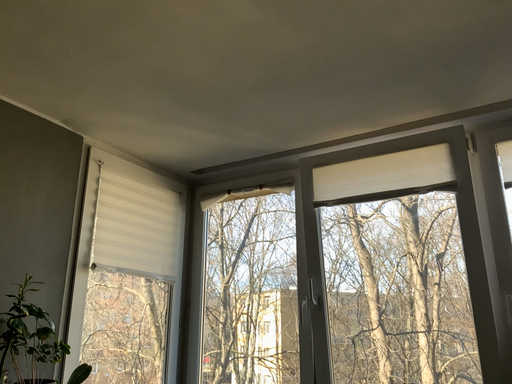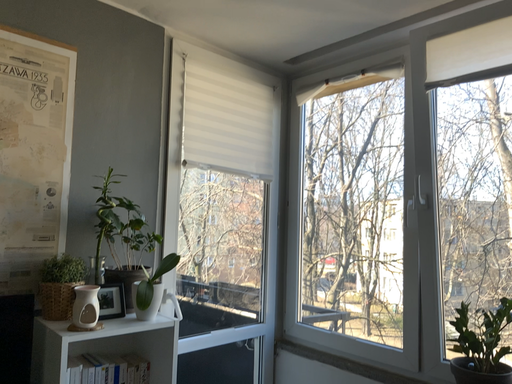
Question: Which way did the camera rotate in the video?

Choices:
 (A) rotated downward
 (B) rotated upward

Answer: (A)